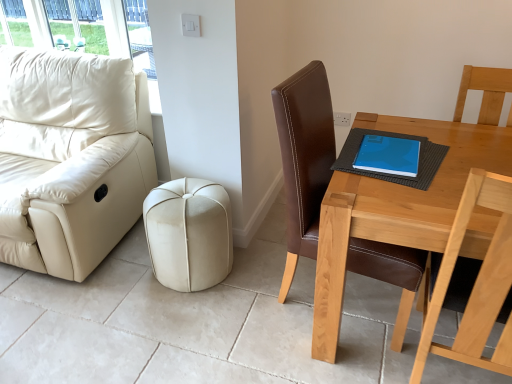
At what (x,y) coordinates should I click in order to perform the action: click on vacant space that is to the left of beige leather ottoman at center. Please return your answer as a coordinate pair (x, y). The image size is (512, 384). Looking at the image, I should click on (118, 280).